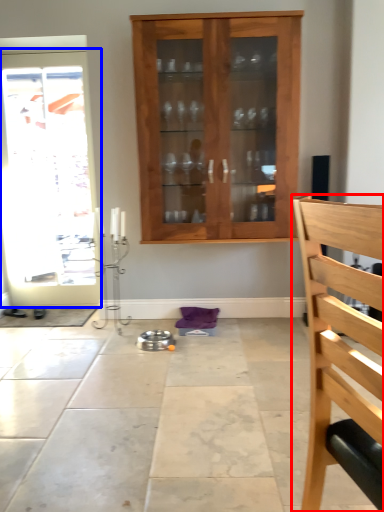
Question: Which object is further to the camera taking this photo, chair (highlighted by a red box) or door (highlighted by a blue box)?

Choices:
 (A) chair
 (B) door

Answer: (B)